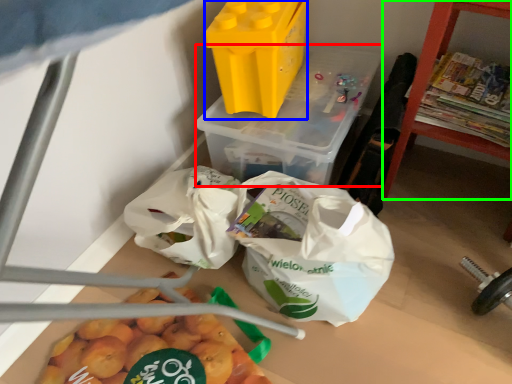
Question: Which object is positioned farthest from yoghurt (highlighted by a red box)? Select from yoghurt (highlighted by a blue box) and furniture (highlighted by a green box).

Choices:
 (A) yoghurt
 (B) furniture

Answer: (B)